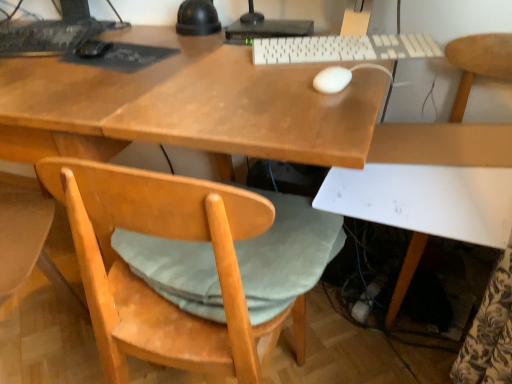
Question: From the image's perspective, relative to white plastic keyboard at center, the 2th computer keyboard in the back-to-front sequence, is white matte chair at lower right above or below?

Choices:
 (A) above
 (B) below

Answer: (B)

Question: Considering the positions of white matte chair at lower right and white plastic keyboard at center, the first computer keyboard in the right-to-left sequence, in the image, is white matte chair at lower right taller or shorter than white plastic keyboard at center, the first computer keyboard in the right-to-left sequence,?

Choices:
 (A) short
 (B) tall

Answer: (B)

Question: Which of these objects is positioned farthest from the black matte mouse at upper left, which is counted as the 2th mouse, starting from the bottom?

Choices:
 (A) white matte chair at lower right
 (B) white matte mouse at center, the 1th mouse positioned from the bottom
 (C) light wood/rough chair at lower left
 (D) white plastic keyboard at center, which is the second computer keyboard in left-to-right order
 (E) black matte keyboard at upper left, the first computer keyboard when ordered from left to right

Answer: (A)

Question: Considering the real-world distances, which object is closest to the white plastic keyboard at center, the 1th computer keyboard when ordered from front to back?

Choices:
 (A) dark gray matte mousepad at upper left
 (B) black matte mouse at upper left, arranged as the 1th mouse when viewed from the left
 (C) light wood/rough chair at lower left
 (D) white plastic desktop computer at upper center
 (E) white matte mouse at center, which is the second mouse in top-to-bottom order

Answer: (D)